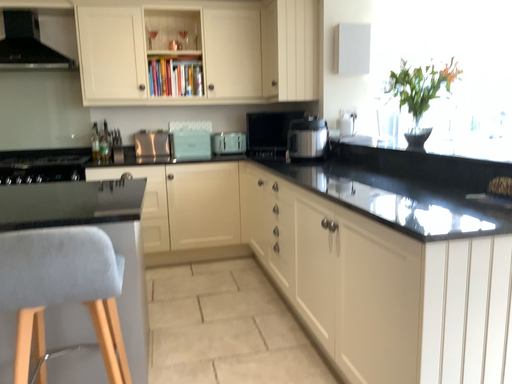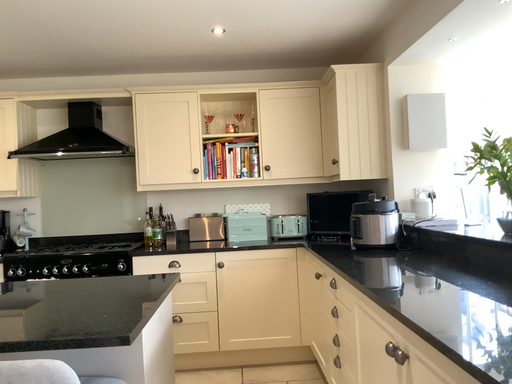
Question: How did the camera likely rotate when shooting the video?

Choices:
 (A) rotated upward
 (B) rotated downward

Answer: (A)